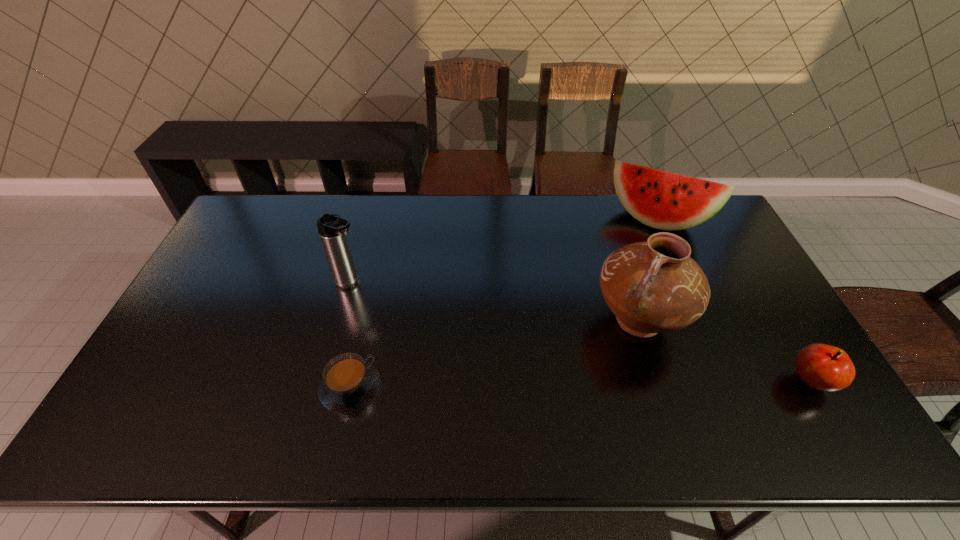
Where is `free point that satisfies the following two spatial constraints: 1. on the back side of the third shortest object; 2. on the right side of the thermos bottle`? Image resolution: width=960 pixels, height=540 pixels. free point that satisfies the following two spatial constraints: 1. on the back side of the third shortest object; 2. on the right side of the thermos bottle is located at coordinates (369, 220).

Where is `vacant space that satisfies the following two spatial constraints: 1. on the back side of the third shortest object; 2. on the left side of the pottery`? Image resolution: width=960 pixels, height=540 pixels. vacant space that satisfies the following two spatial constraints: 1. on the back side of the third shortest object; 2. on the left side of the pottery is located at coordinates (607, 220).